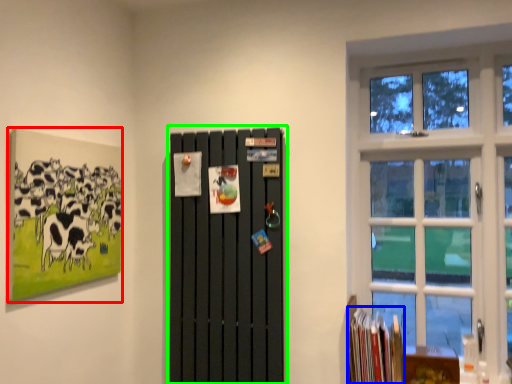
Question: Which is farther away from picture frame (highlighted by a red box)? book (highlighted by a blue box) or barn door (highlighted by a green box)?

Choices:
 (A) book
 (B) barn door

Answer: (A)